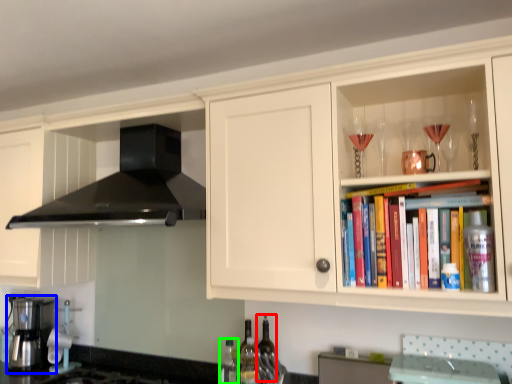
Question: Which object is positioned closest to bottle (highlighted by a red box)? Select from kitchen appliance (highlighted by a blue box) and bottle (highlighted by a green box).

Choices:
 (A) kitchen appliance
 (B) bottle

Answer: (B)